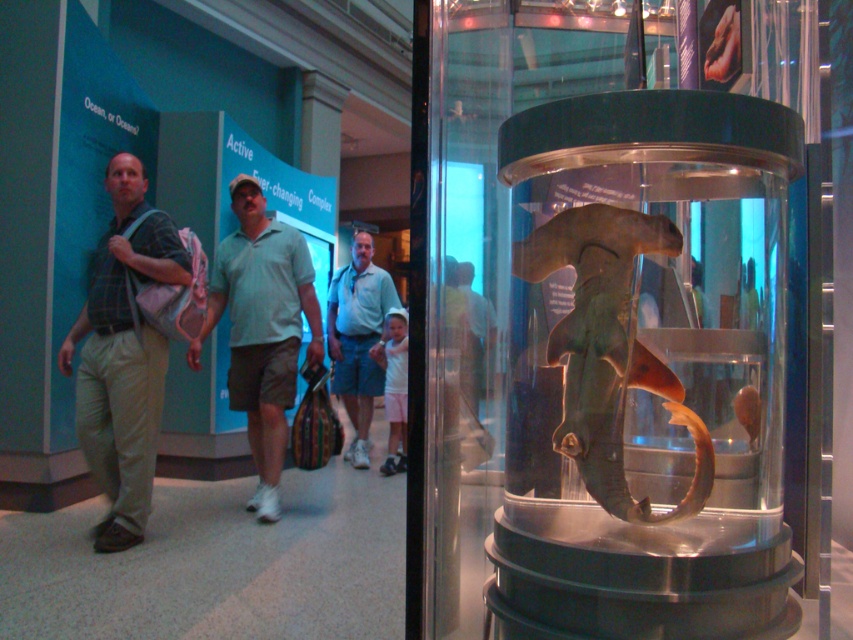
Question: Which object is positioned closest to the light green cotton shirt at center?

Choices:
 (A) plaid fabric shirt at left
 (B) translucent green shark at center

Answer: (A)

Question: Which object is the closest to the light green cotton shirt at center?

Choices:
 (A) plaid fabric shirt at left
 (B) translucent green shark at center

Answer: (A)

Question: Does plaid fabric shirt at left appear under light green cotton shirt at center?

Choices:
 (A) no
 (B) yes

Answer: (A)

Question: Is translucent green shark at center below light gray cotton polo shirt at center?

Choices:
 (A) yes
 (B) no

Answer: (B)

Question: Where is light gray cotton polo shirt at center located in relation to light green cotton shirt at center in the image?

Choices:
 (A) below
 (B) above

Answer: (B)

Question: Which of the following is the closest to the observer?

Choices:
 (A) light gray cotton polo shirt at center
 (B) light green cotton shirt at center
 (C) plaid fabric shirt at left
 (D) translucent green shark at center

Answer: (D)